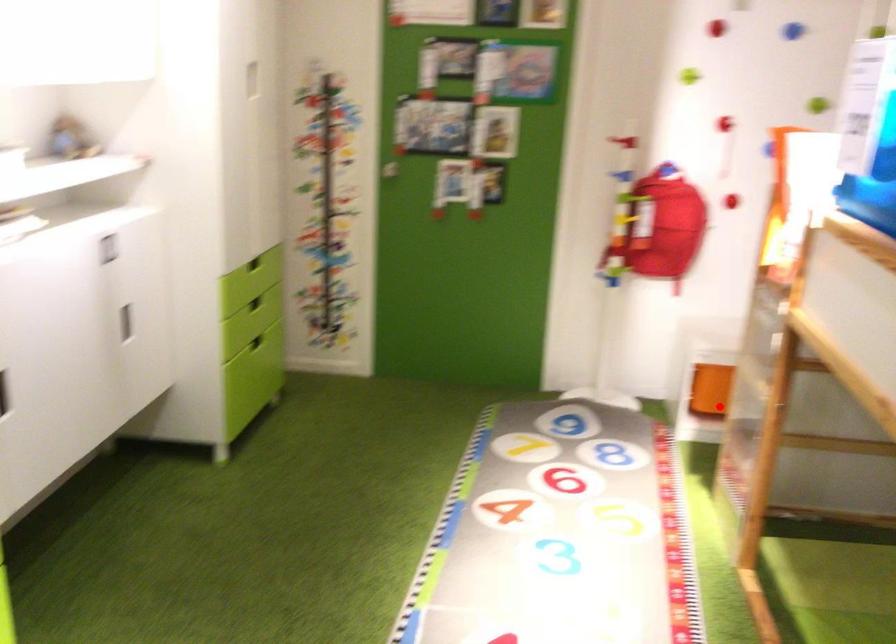
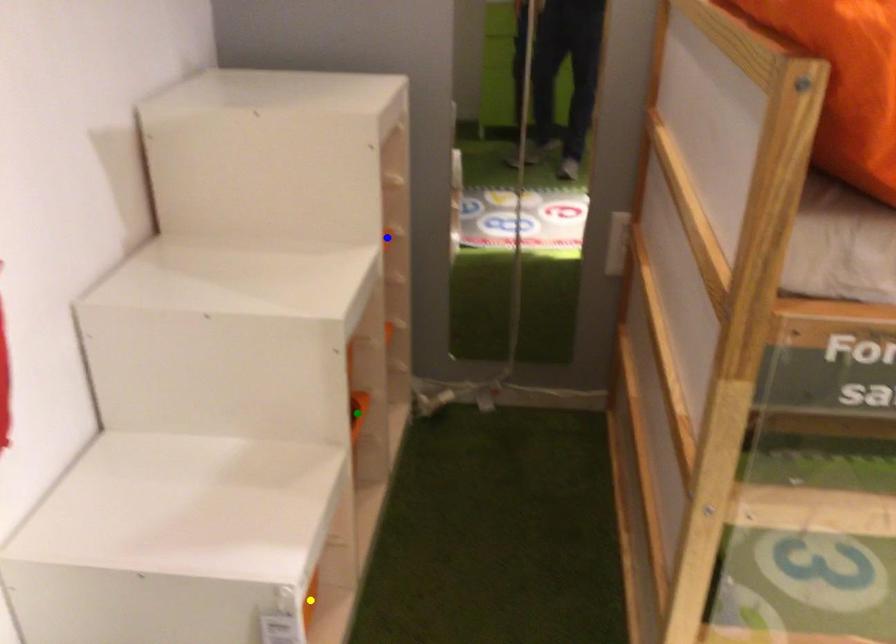
Question: I am providing you with two images of the same scene from different viewpoints. A red point is marked on the first image. You are given multiple points on the second image. Which point in image 2 is actually the same real-world point as the red point in image 1?

Choices:
 (A) green point
 (B) yellow point
 (C) blue point

Answer: (B)